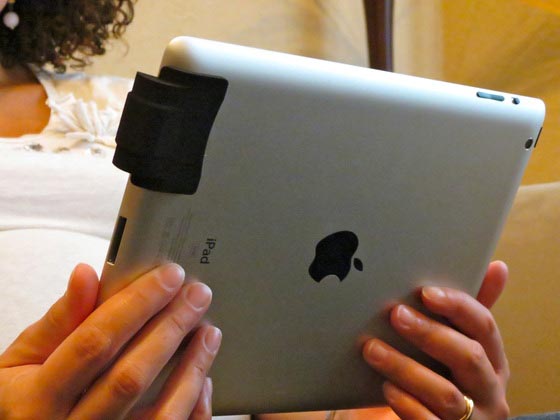
Where is `wall`? wall is located at coordinates (292, 21).